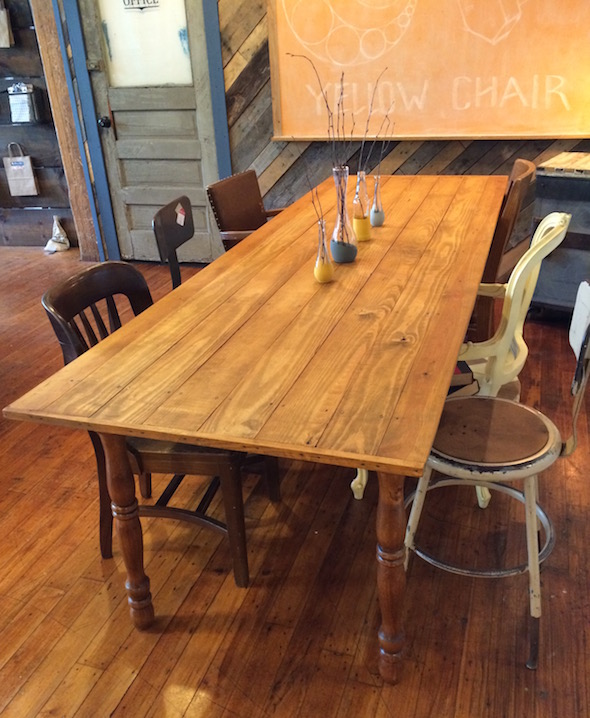
Where is `2 chairs with same style of elongated back rest`? The height and width of the screenshot is (718, 590). 2 chairs with same style of elongated back rest is located at coordinates (185, 225), (584, 335).